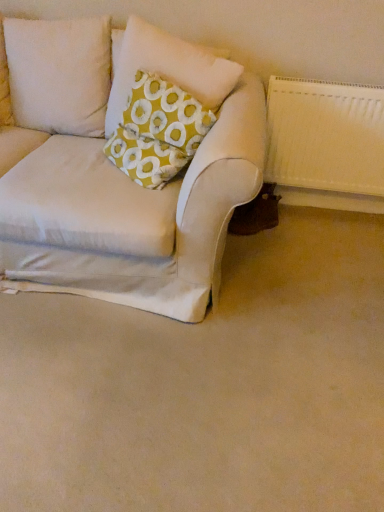
Question: Would you say yellow fabric pillow at upper left contains beige fabric couch at lower left?

Choices:
 (A) yes
 (B) no

Answer: (B)

Question: Does yellow fabric pillow at upper left have a lesser height compared to beige fabric couch at lower left?

Choices:
 (A) yes
 (B) no

Answer: (B)

Question: Are yellow fabric pillow at upper left and beige fabric couch at lower left located far from each other?

Choices:
 (A) no
 (B) yes

Answer: (A)

Question: From a real-world perspective, is yellow fabric pillow at upper left positioned under beige fabric couch at lower left based on gravity?

Choices:
 (A) yes
 (B) no

Answer: (B)

Question: Are yellow fabric pillow at upper left and beige fabric couch at lower left beside each other?

Choices:
 (A) yes
 (B) no

Answer: (B)

Question: Is yellow fabric pillow at upper left to the right of beige fabric couch at lower left from the viewer's perspective?

Choices:
 (A) no
 (B) yes

Answer: (B)

Question: From a real-world perspective, is beige fabric couch at lower left over white textured radiator at right?

Choices:
 (A) no
 (B) yes

Answer: (A)

Question: Is beige fabric couch at lower left shorter than white textured radiator at right?

Choices:
 (A) no
 (B) yes

Answer: (B)

Question: From the image's perspective, is beige fabric couch at lower left over white textured radiator at right?

Choices:
 (A) yes
 (B) no

Answer: (B)

Question: Is beige fabric couch at lower left facing away from white textured radiator at right?

Choices:
 (A) yes
 (B) no

Answer: (B)

Question: From a real-world perspective, is beige fabric couch at lower left physically below white textured radiator at right?

Choices:
 (A) yes
 (B) no

Answer: (A)

Question: Could white textured radiator at right be considered to be inside beige fabric couch at lower left?

Choices:
 (A) no
 (B) yes

Answer: (A)

Question: Is beige fabric couch at lower left surrounding yellow fabric pillow at upper left?

Choices:
 (A) yes
 (B) no

Answer: (B)